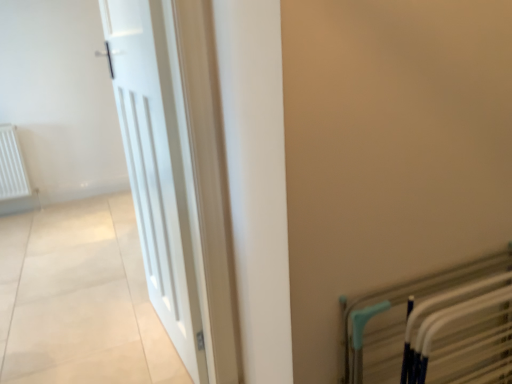
Locate an element on the screen. The height and width of the screenshot is (384, 512). vacant space in white wooden door at left (from a real-world perspective) is located at coordinates (167, 344).